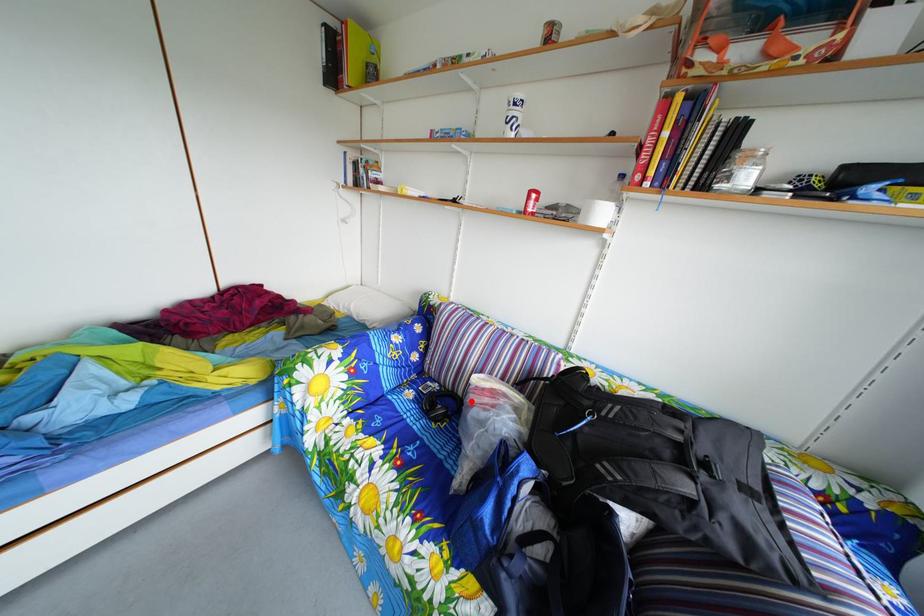
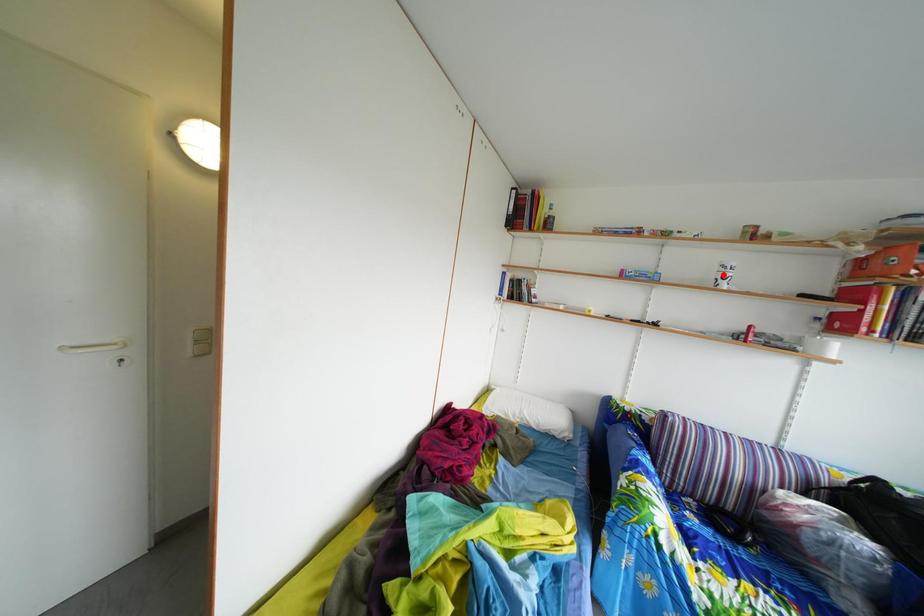
I am providing you with two images of the same scene from different viewpoints. A red point is marked on the first image and another point is marked on the second image. Is the marked point in image1 the same physical position as the marked point in image2?

No